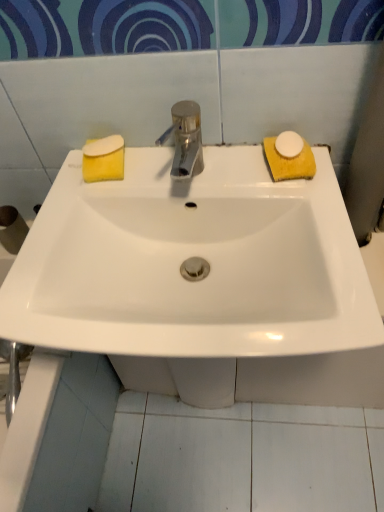
Question: Is white matte soap at right, the 1th soap from the right, not near white glossy sink at center?

Choices:
 (A) yes
 (B) no

Answer: (B)

Question: From the image's perspective, does white matte soap at right, the 1th soap from the right, appear higher than white glossy sink at center?

Choices:
 (A) no
 (B) yes

Answer: (B)

Question: Can you confirm if white matte soap at right, the 1th soap from the right, is shorter than white glossy sink at center?

Choices:
 (A) no
 (B) yes

Answer: (B)

Question: From the image's perspective, does white matte soap at right, the 1th soap from the right, appear lower than white glossy sink at center?

Choices:
 (A) yes
 (B) no

Answer: (B)

Question: Is white glossy sink at center at the back of white matte soap at right, the 1th soap from the right?

Choices:
 (A) no
 (B) yes

Answer: (A)

Question: Based on their sizes in the image, would you say white matte soap at right, arranged as the third soap when viewed from the left, is bigger or smaller than yellow sponge at left, the 3th soap in the right-to-left sequence?

Choices:
 (A) big
 (B) small

Answer: (A)

Question: From their relative heights in the image, would you say white matte soap at right, the 1th soap from the right, is taller or shorter than yellow sponge at left, the 1th soap in the left-to-right sequence?

Choices:
 (A) tall
 (B) short

Answer: (A)

Question: From the image's perspective, is white matte soap at right, arranged as the third soap when viewed from the left, located above or below yellow sponge at left, the 1th soap in the left-to-right sequence?

Choices:
 (A) above
 (B) below

Answer: (B)

Question: In terms of width, does white matte soap at right, the 1th soap from the right, look wider or thinner when compared to yellow sponge at left, the 3th soap in the right-to-left sequence?

Choices:
 (A) wide
 (B) thin

Answer: (A)

Question: From a real-world perspective, is white matte soap at right, arranged as the third soap when viewed from the left, above or below polished metallic tap at center?

Choices:
 (A) below
 (B) above

Answer: (A)

Question: Would you say white matte soap at right, arranged as the third soap when viewed from the left, is to the left or to the right of polished metallic tap at center in the picture?

Choices:
 (A) right
 (B) left

Answer: (A)

Question: Considering their positions, is white matte soap at right, arranged as the third soap when viewed from the left, located in front of or behind polished metallic tap at center?

Choices:
 (A) front
 (B) behind

Answer: (B)

Question: In terms of width, does white matte soap at right, arranged as the third soap when viewed from the left, look wider or thinner when compared to polished metallic tap at center?

Choices:
 (A) wide
 (B) thin

Answer: (B)

Question: Is white glossy sink at center situated inside yellow sponge at left, the 3th soap in the right-to-left sequence, or outside?

Choices:
 (A) outside
 (B) inside

Answer: (A)

Question: Does point (185, 313) appear closer or farther from the camera than point (94, 140)?

Choices:
 (A) farther
 (B) closer

Answer: (B)